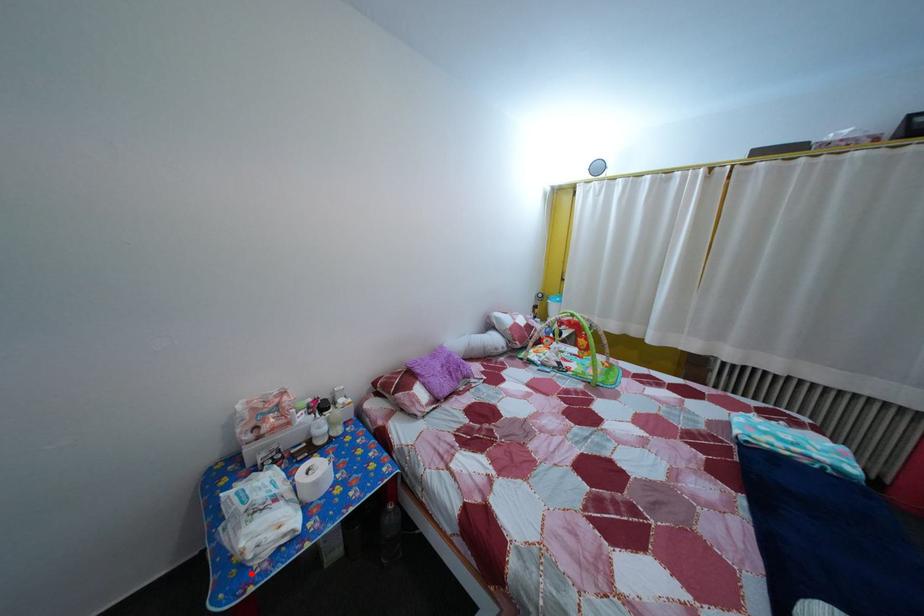
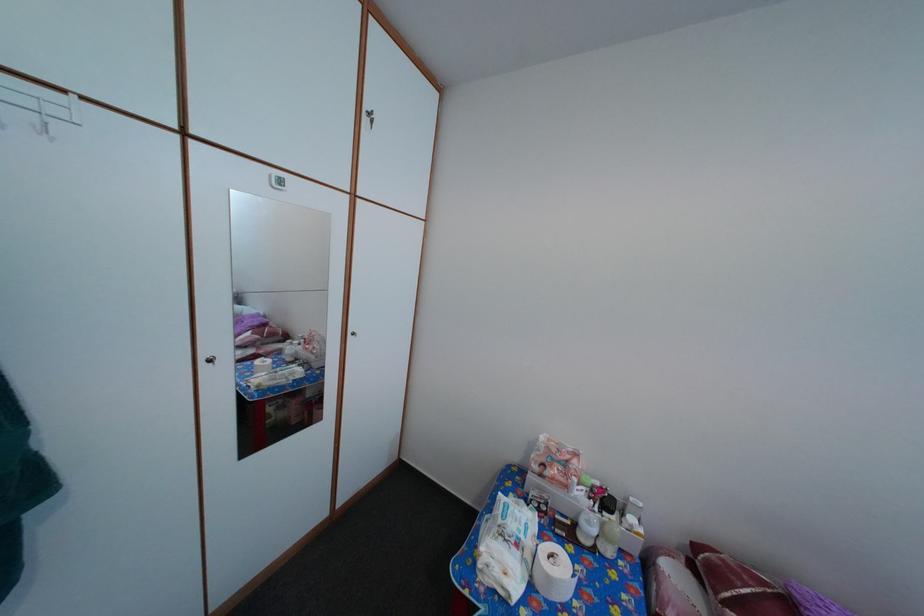
The point at the highlighted location is marked in the first image. Where is the corresponding point in the second image?

(484, 572)